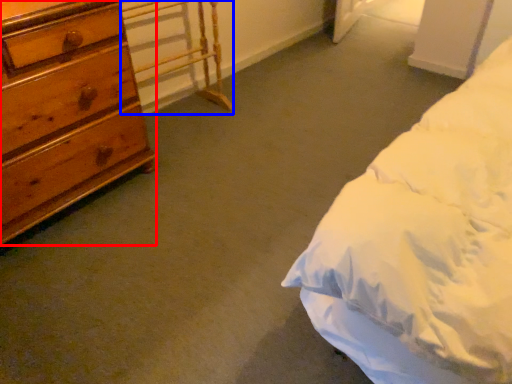
Question: Which point is further to the camera, chest of drawers (highlighted by a red box) or table (highlighted by a blue box)?

Choices:
 (A) chest of drawers
 (B) table

Answer: (B)